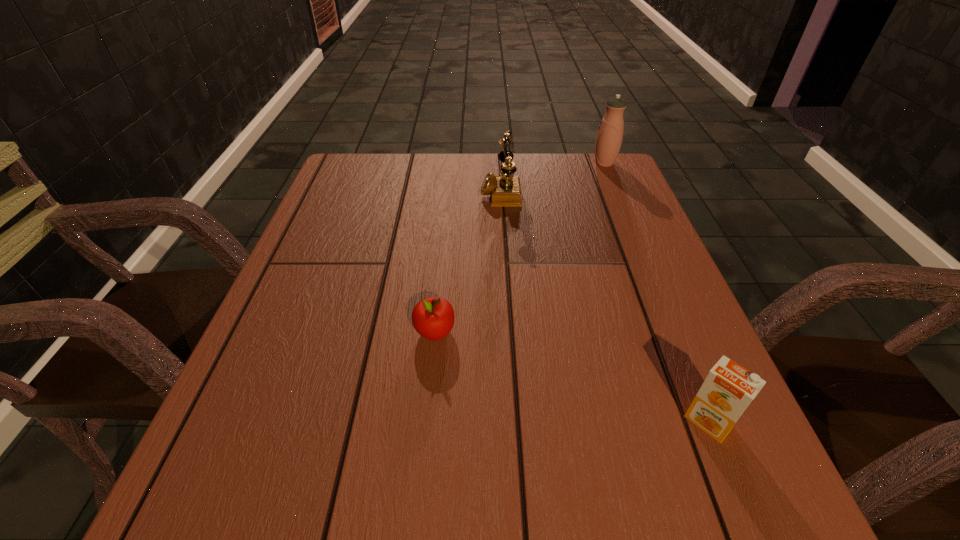
In the image, there is a desktop. At what (x,y) coordinates should I click in order to perform the action: click on vacant space at the near edge. Please return your answer as a coordinate pair (x, y). The height and width of the screenshot is (540, 960). Looking at the image, I should click on (629, 500).

At what (x,y) coordinates should I click in order to perform the action: click on vacant region at the left edge of the desktop. Please return your answer as a coordinate pair (x, y). The image size is (960, 540). Looking at the image, I should click on (257, 408).

In the image, there is a desktop. Find the location of `free space at the right edge`. free space at the right edge is located at coordinates [x=666, y=266].

Identify the location of free space at the far left corner. Image resolution: width=960 pixels, height=540 pixels. (393, 166).

You are a GUI agent. You are given a task and a screenshot of the screen. Output one action in this format:
    pyautogui.click(x=<x>, y=<y>)
    Task: Click on the vacant space at the far right corner of the desktop
    
    Given the screenshot: What is the action you would take?
    pyautogui.click(x=577, y=171)

Where is `free spot between the third object from right to left and the third tallest object`? The image size is (960, 540). free spot between the third object from right to left and the third tallest object is located at coordinates [604, 306].

Locate an element on the screen. free space between the telephone and the second nearest object is located at coordinates (468, 261).

Locate an element on the screen. free space that is in between the tallest object and the shortest object is located at coordinates (519, 248).

Image resolution: width=960 pixels, height=540 pixels. Find the location of `free space between the orange juice and the apple`. free space between the orange juice and the apple is located at coordinates (571, 376).

Where is `free spot between the orange juice and the third farthest object`? The image size is (960, 540). free spot between the orange juice and the third farthest object is located at coordinates (571, 376).